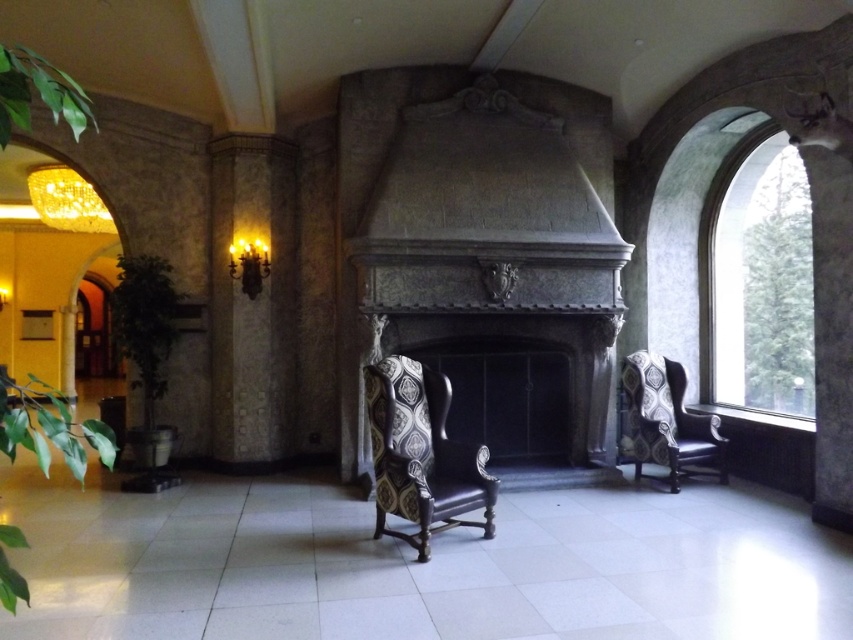
Which is behind, point (780, 339) or point (683, 451)?

The point (780, 339) is more distant.

Who is more distant from viewer, (755, 262) or (686, 436)?

Positioned behind is point (755, 262).

Where is `clear glass window at right`? This screenshot has height=640, width=853. clear glass window at right is located at coordinates (761, 284).

Does dark stone fireplace at center have a lesser width compared to patterned fabric wingback chair at right?

In fact, dark stone fireplace at center might be wider than patterned fabric wingback chair at right.

Can you confirm if dark stone fireplace at center is positioned below patterned fabric wingback chair at right?

Actually, dark stone fireplace at center is above patterned fabric wingback chair at right.

This screenshot has height=640, width=853. Describe the element at coordinates (485, 240) in the screenshot. I see `dark stone fireplace at center` at that location.

Find the location of a particular element. dark stone fireplace at center is located at coordinates (485, 240).

From the picture: Which of these two, dark stone fireplace at center or clear glass window at right, stands shorter?

clear glass window at right

Is point (363, 81) in front of point (810, 243)?

No, (363, 81) is behind (810, 243).

Between point (596, 340) and point (718, 304), which one is positioned behind?

The point (718, 304) is behind.

Locate an element on the screen. The image size is (853, 640). dark stone fireplace at center is located at coordinates (485, 240).